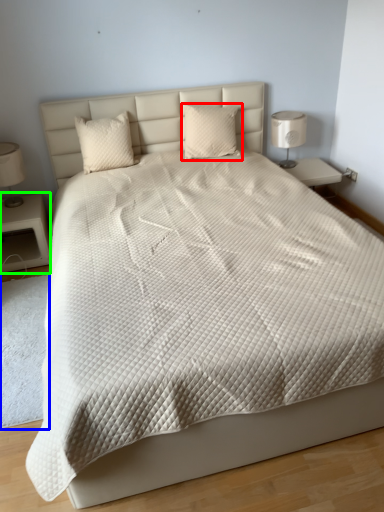
Question: Which is nearer to the pillow (highlighted by a red box)? mat (highlighted by a blue box) or nightstand (highlighted by a green box).

Choices:
 (A) mat
 (B) nightstand

Answer: (B)